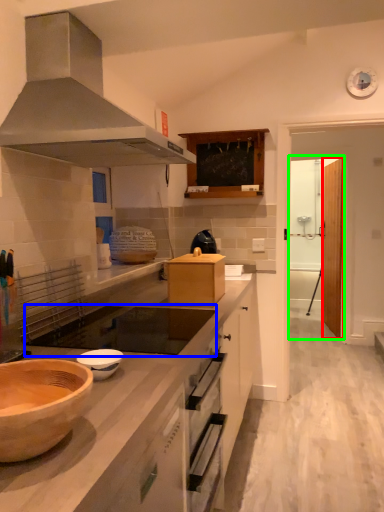
Question: Which object is the closest to the glass door (highlighted by a red box)? Choose among these: gas stove (highlighted by a blue box) or glass door (highlighted by a green box).

Choices:
 (A) gas stove
 (B) glass door

Answer: (B)